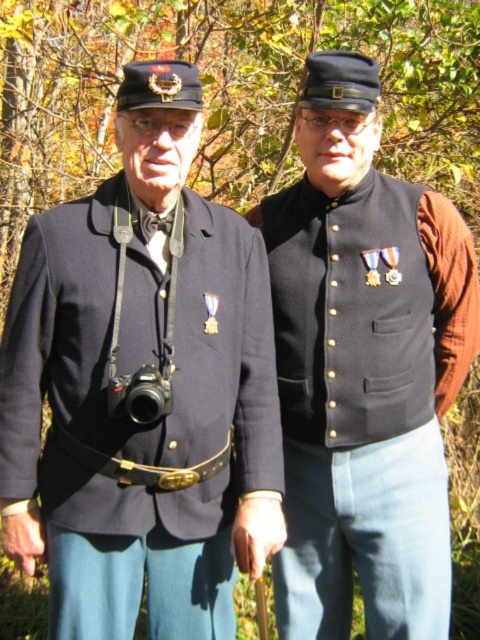
Can you confirm if matte black jacket at center is smaller than black plastic camera at left?

No, matte black jacket at center is not smaller than black plastic camera at left.

Does matte black jacket at center have a lesser width compared to black plastic camera at left?

No.

The height and width of the screenshot is (640, 480). I want to click on matte black jacket at center, so click(132, 372).

Which is more to the right, matte black jacket at center or matte black vest at center?

matte black vest at center

Who is more forward, (x=2, y=531) or (x=404, y=340)?

Positioned in front is point (x=2, y=531).

What do you see at coordinates (132, 372) in the screenshot? I see `matte black jacket at center` at bounding box center [132, 372].

Identify the location of matte black jacket at center. The height and width of the screenshot is (640, 480). (132, 372).

Who is positioned more to the right, matte black vest at center or black plastic camera at left?

matte black vest at center

Is point (421, 188) positioned in front of point (165, 413)?

That is False.

Is point (282, 314) closer to viewer compared to point (143, 420)?

No, (282, 314) is behind (143, 420).

What are the coordinates of `matte black vest at center` in the screenshot? It's located at (367, 397).